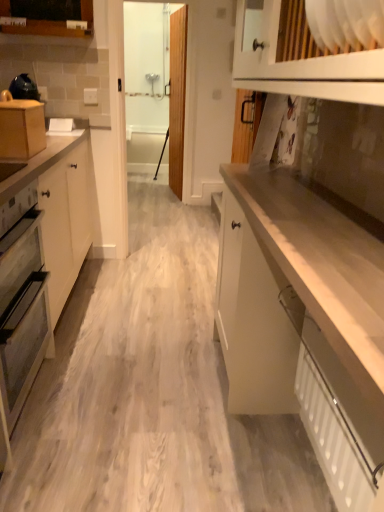
Question: Is white matte cabinet at center, positioned as the third cabinetry in left-to-right order, inside the boundaries of matte gray oven at left, or outside?

Choices:
 (A) outside
 (B) inside

Answer: (A)

Question: Is white matte cabinet at center, the 3th cabinetry from the top, in front of or behind matte gray oven at left in the image?

Choices:
 (A) front
 (B) behind

Answer: (A)

Question: Which is farther from the white textured radiator at lower right?

Choices:
 (A) wooden cabinet at upper left, the third cabinetry in the front-to-back sequence
 (B) matte wood box at left, which is counted as the second cabinetry, starting from the right
 (C) white matte cabinet at center, the 3th cabinetry from the top
 (D) transparent glass door at upper center
 (E) matte gray oven at left

Answer: (D)

Question: Which object is positioned closest to the transparent glass door at upper center?

Choices:
 (A) white matte cabinet at center, the 3th cabinetry from the top
 (B) white textured radiator at lower right
 (C) matte gray oven at left
 (D) matte wood box at left, which is counted as the second cabinetry, starting from the right
 (E) wooden cabinet at upper left, which is counted as the 3th cabinetry, starting from the bottom

Answer: (E)